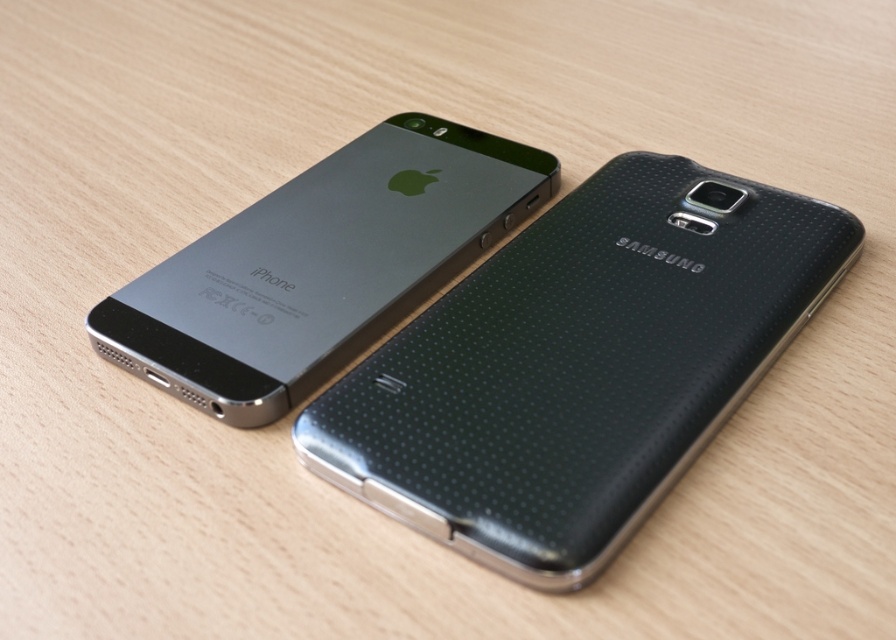
Is black textured phone at center shorter than satin black iphone at upper left?

No, black textured phone at center is not shorter than satin black iphone at upper left.

Does point (545, 420) lie behind point (412, 129)?

No, it is not.

Describe the element at coordinates (580, 365) in the screenshot. I see `black textured phone at center` at that location.

The height and width of the screenshot is (640, 896). What are the coordinates of `black textured phone at center` in the screenshot? It's located at (580, 365).